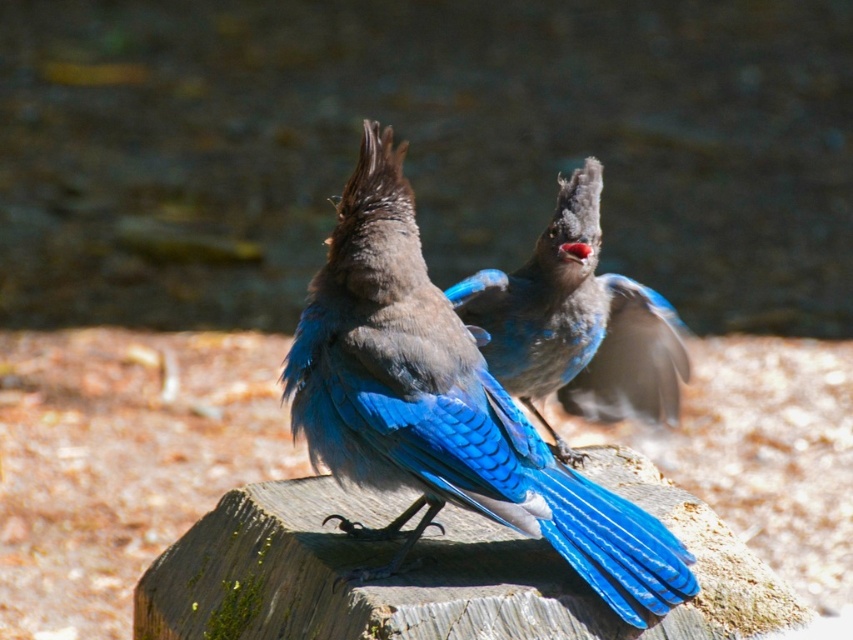
You are a birdwatcher trying to estimate distances between two groups of feathers on a wooden stump. The shiny blue feathers at center and the blue glossy feathers at center are both visible. Based on the scene, can you determine which group is closer to you?

The shiny blue feathers at center is closer to you since it is 67.03 centimeters away from the blue glossy feathers at center, and the description specifies the distance from the shiny blue feathers to the other group.

You are a photographer trying to capture both birds in focus. You notice two points of interest labeled as point (370,403) and point (575,368). Based on their positions, which point should you focus on to ensure the bird closer to the camera is sharp?

Point (370,403) is closer to the viewer than point (575,368), so you should focus on point (370,403) to ensure the closer bird is sharp.